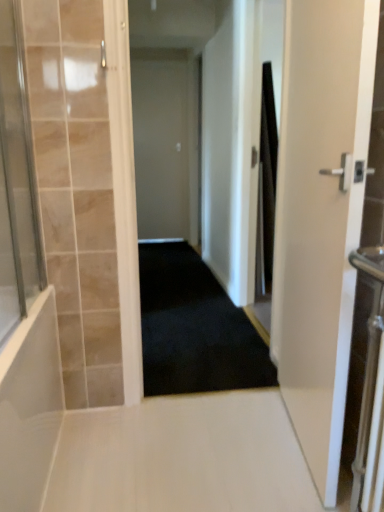
The height and width of the screenshot is (512, 384). What are the coordinates of `free space above white glossy floor at center (from a real-world perspective)` in the screenshot? It's located at (183, 444).